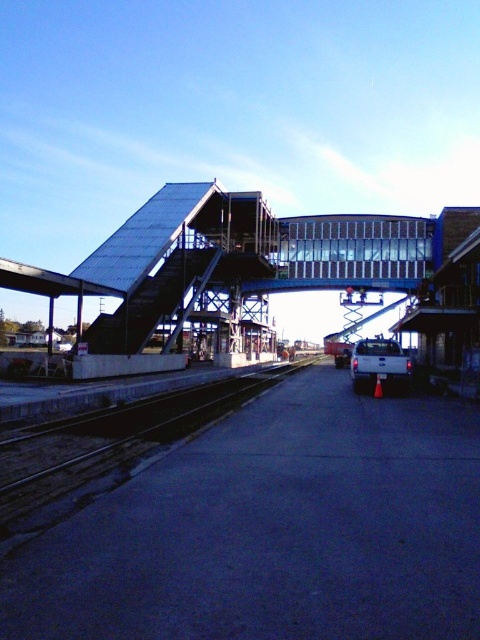
This screenshot has height=640, width=480. Identify the location of metallic gray platform at center. (233, 266).

Can you confirm if metallic gray platform at center is positioned to the left of dark gray concrete train track at center?

In fact, metallic gray platform at center is to the right of dark gray concrete train track at center.

Which is in front, point (204, 314) or point (62, 492)?

Point (62, 492) is more forward.

The height and width of the screenshot is (640, 480). I want to click on metallic gray platform at center, so click(x=233, y=266).